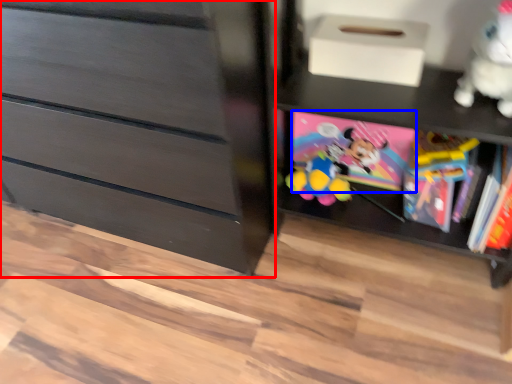
Question: Which object is closer to the camera taking this photo, chest of drawers (highlighted by a red box) or book (highlighted by a blue box)?

Choices:
 (A) chest of drawers
 (B) book

Answer: (A)